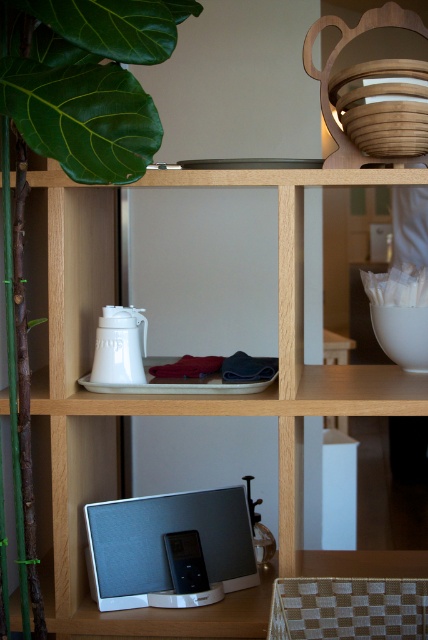
You are organizing a small gift basket and need to choose between the green leafy plant at upper left and the silver fabric speaker at lower center. Based on their sizes, which item would require more space to package?

The green leafy plant at upper left is bigger than the silver fabric speaker at lower center, so it would require more space to package.

You are organizing items on a shelf and need to place both the green leafy plant at upper left and the silver fabric speaker at lower center. Considering their widths, which item should you place first to ensure they both fit on the shelf?

The green leafy plant at upper left has a lesser width compared to the silver fabric speaker at lower center, so you should place the silver fabric speaker at lower center first to accommodate its larger size, then the green leafy plant at upper left.